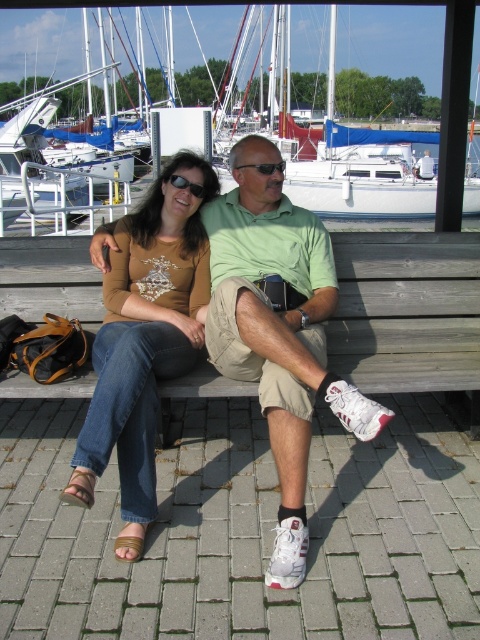
Question: Does black plastic sunglasses at upper center have a larger size compared to black plastic sunglasses at center?

Choices:
 (A) no
 (B) yes

Answer: (A)

Question: Can you confirm if wooden bench at center is positioned to the right of black plastic sunglasses at center?

Choices:
 (A) yes
 (B) no

Answer: (A)

Question: Which object appears farthest from the camera in this image?

Choices:
 (A) matte brown leather shoes at lower center
 (B) black plastic sunglasses at center
 (C) white glossy sailboat at center
 (D) black plastic sunglasses at upper center

Answer: (C)

Question: Which point is farther to the camera?

Choices:
 (A) matte brown shirt at center
 (B) wooden bench at center

Answer: (B)

Question: Is matte brown shirt at center above black plastic sunglasses at center?

Choices:
 (A) no
 (B) yes

Answer: (A)

Question: Which object is farther from the camera taking this photo?

Choices:
 (A) white glossy sailboat at center
 (B) matte brown leather shoes at lower center
 (C) wooden bench at center
 (D) matte brown shirt at center

Answer: (A)